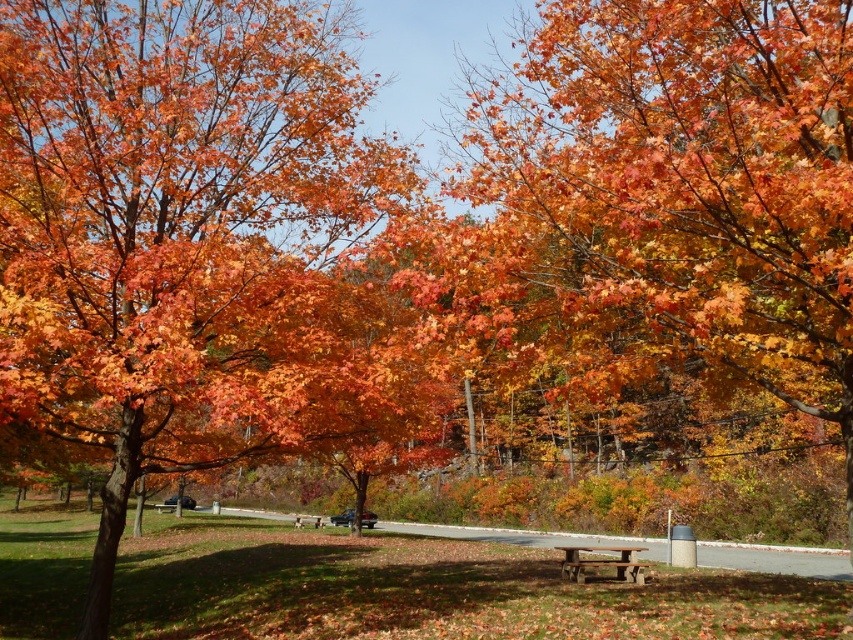
You are planning to take a photo of the rustic wood picnic table at center and the orange autumn leaves at center. Since you want both in the frame, where should you position yourself relative to the picnic table?

You should position yourself to the right of the rustic wood picnic table at center so that the orange autumn leaves at center, which are to the left of the picnic table, will be included in the frame.

You are planning to take a photo of the orange autumn leaves at center and the rustic wood picnic table at center from a standing position. Which object should you focus on first if you want to capture both in the same frame without moving the camera?

The orange autumn leaves at center should be focused on first because they are above the rustic wood picnic table at center, so adjusting the camera angle to include both would require framing from the top down.